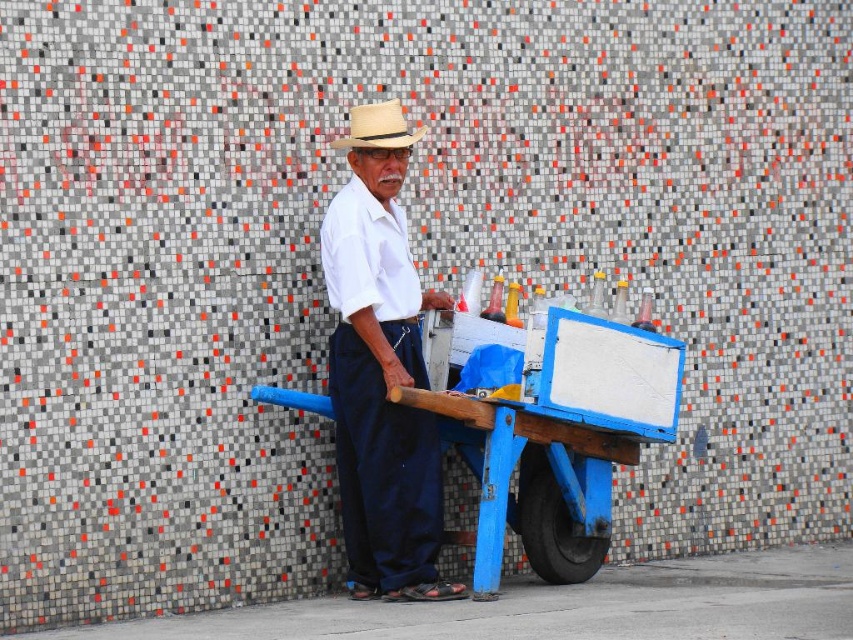
Is white cotton shirt at center bigger than beige straw fedora at center?

Indeed, white cotton shirt at center has a larger size compared to beige straw fedora at center.

Which of these two, white cotton shirt at center or beige straw fedora at center, stands taller?

white cotton shirt at center

Find the location of a particular element. The width and height of the screenshot is (853, 640). white cotton shirt at center is located at coordinates (381, 371).

Which of these two, blue painted wood cart at center or white cotton shirt at center, stands taller?

With more height is white cotton shirt at center.

Does blue painted wood cart at center come behind white cotton shirt at center?

No, it is not.

Is point (624, 403) more distant than point (378, 259)?

No.

Where is `blue painted wood cart at center`? Image resolution: width=853 pixels, height=640 pixels. blue painted wood cart at center is located at coordinates (556, 438).

Does blue painted wood cart at center appear over beige straw fedora at center?

No, blue painted wood cart at center is not above beige straw fedora at center.

Can you confirm if blue painted wood cart at center is positioned to the right of beige straw fedora at center?

Correct, you'll find blue painted wood cart at center to the right of beige straw fedora at center.

Is point (679, 358) closer to camera compared to point (349, 138)?

Yes, point (679, 358) is in front of point (349, 138).

The height and width of the screenshot is (640, 853). I want to click on blue painted wood cart at center, so click(x=556, y=438).